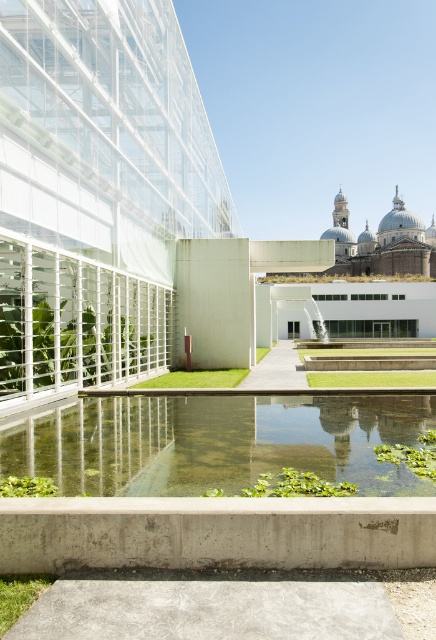
Question: Is clear water pond at center wider than clear glass water feature at center?

Choices:
 (A) no
 (B) yes

Answer: (B)

Question: Which point is closer to the camera taking this photo?

Choices:
 (A) (33, 465)
 (B) (322, 332)

Answer: (A)

Question: Can you confirm if clear water pond at center is positioned above clear glass water feature at center?

Choices:
 (A) no
 (B) yes

Answer: (A)

Question: Which point is farther from the camera taking this photo?

Choices:
 (A) (37, 438)
 (B) (313, 337)

Answer: (B)

Question: Is clear water pond at center thinner than clear glass water feature at center?

Choices:
 (A) no
 (B) yes

Answer: (A)

Question: Which object is farther from the camera taking this photo?

Choices:
 (A) clear glass water feature at center
 (B) clear water pond at center

Answer: (A)